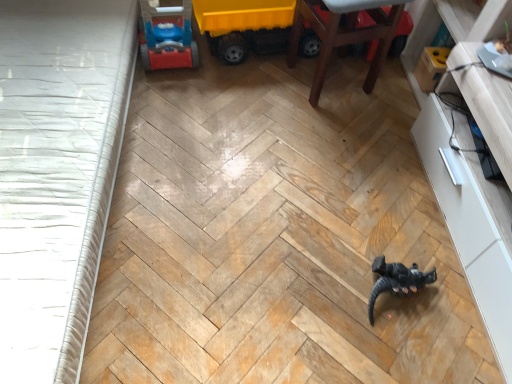
Find the location of `free location to the left of wooden chair at upper right`. free location to the left of wooden chair at upper right is located at coordinates (256, 86).